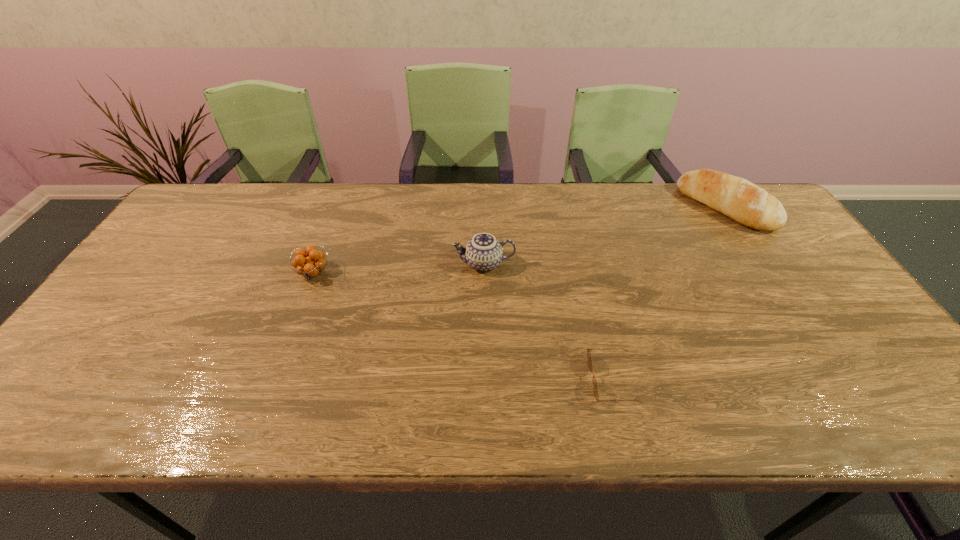
The width and height of the screenshot is (960, 540). Identify the location of vacant space that's between the third object from right to left and the orange fruit. (398, 268).

Where is `vacant region between the rightmost object and the orange fruit`? This screenshot has height=540, width=960. vacant region between the rightmost object and the orange fruit is located at coordinates (519, 240).

Identify the location of free area in between the bread and the sunglasses. The height and width of the screenshot is (540, 960). (669, 293).

Select which object appears as the closest to the leftmost object. Please provide its 2D coordinates. Your answer should be formatted as a tuple, i.e. [(x, y)], where the tuple contains the x and y coordinates of a point satisfying the conditions above.

[(483, 252)]

Where is `object that stands as the third closest to the orange fruit`? This screenshot has width=960, height=540. object that stands as the third closest to the orange fruit is located at coordinates (737, 198).

This screenshot has width=960, height=540. Identify the location of free space that satisfies the following two spatial constraints: 1. from the spout of the second object from left to right; 2. on the front side of the leftmost object. (484, 273).

Locate an element on the screen. This screenshot has height=540, width=960. free space that satisfies the following two spatial constraints: 1. from the spout of the chinaware; 2. on the front side of the second shortest object is located at coordinates (484, 273).

Image resolution: width=960 pixels, height=540 pixels. I want to click on free space that satisfies the following two spatial constraints: 1. from the spout of the chinaware; 2. on the front side of the second shortest object, so click(484, 273).